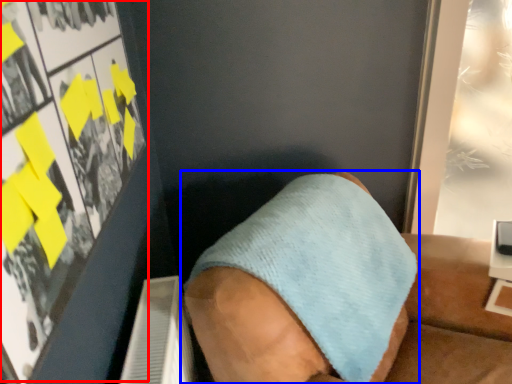
Question: Which point is further to the camera, poster page (highlighted by a red box) or footwear (highlighted by a blue box)?

Choices:
 (A) poster page
 (B) footwear

Answer: (B)